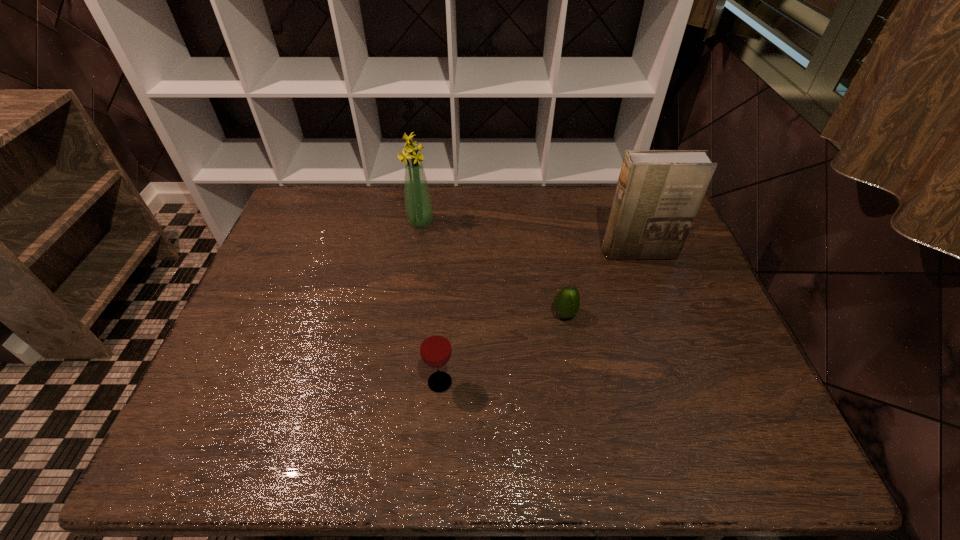
At what (x,y) coordinates should I click in order to perform the action: click on vacant area that lies between the bouquet and the phonebook. Please return your answer as a coordinate pair (x, y). The width and height of the screenshot is (960, 540). Looking at the image, I should click on (529, 237).

I want to click on empty location between the rightmost object and the second nearest object, so click(x=601, y=284).

Locate an element on the screen. free space between the nearest object and the rightmost object is located at coordinates (539, 318).

You are a GUI agent. You are given a task and a screenshot of the screen. Output one action in this format:
    pyautogui.click(x=<x>, y=<y>)
    Task: Click on the blank region between the phonebook and the second object from right to left
    This screenshot has width=960, height=540.
    Given the screenshot: What is the action you would take?
    click(601, 284)

Where is `free space between the nearest object and the avocado`? free space between the nearest object and the avocado is located at coordinates (502, 348).

Where is `free space between the glass and the bouquet`? This screenshot has height=540, width=960. free space between the glass and the bouquet is located at coordinates (430, 302).

Where is `vacant space that's between the second nearest object and the farthest object`? This screenshot has height=540, width=960. vacant space that's between the second nearest object and the farthest object is located at coordinates (492, 268).

Locate an element on the screen. object that stands as the second closest to the shortest object is located at coordinates (435, 347).

You are a GUI agent. You are given a task and a screenshot of the screen. Output one action in this format:
    pyautogui.click(x=<x>, y=<y>)
    Task: Click on the object that can be found as the closest to the rightmost object
    Image resolution: width=960 pixels, height=540 pixels.
    Given the screenshot: What is the action you would take?
    pyautogui.click(x=567, y=302)

What are the coordinates of `vacant area in the image that satisfies the following two spatial constraints: 1. on the back side of the second object from right to left; 2. on the front-facing side of the farthest object` in the screenshot? It's located at (548, 221).